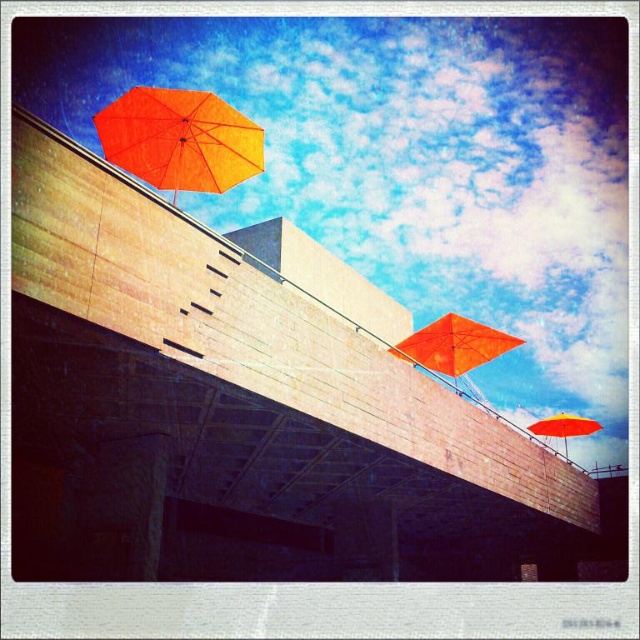
Is point (435, 330) positioned behind point (564, 458)?

No, it is in front of (564, 458).

Between orange matte umbrella at center and orange matte umbrella at upper right, which one appears on the left side from the viewer's perspective?

From the viewer's perspective, orange matte umbrella at center appears more on the left side.

Is point (422, 337) more distant than point (573, 428)?

No, (422, 337) is closer to viewer.

The height and width of the screenshot is (640, 640). In order to click on orange matte umbrella at center in this screenshot , I will do `click(452, 346)`.

Which is above, orange matte umbrella at upper left or orange matte umbrella at upper right?

orange matte umbrella at upper left is above.

Does orange matte umbrella at upper left have a lesser height compared to orange matte umbrella at upper right?

Indeed, orange matte umbrella at upper left has a lesser height compared to orange matte umbrella at upper right.

Where is `orange matte umbrella at upper left`? The height and width of the screenshot is (640, 640). orange matte umbrella at upper left is located at coordinates (179, 140).

Between point (164, 141) and point (419, 337), which one is positioned in front?

Point (164, 141)

Is orange matte umbrella at upper left below orange matte umbrella at center?

Actually, orange matte umbrella at upper left is above orange matte umbrella at center.

Is point (140, 150) behind point (417, 348)?

No, (140, 150) is closer to viewer.

Find the location of a particular element. orange matte umbrella at upper left is located at coordinates (179, 140).